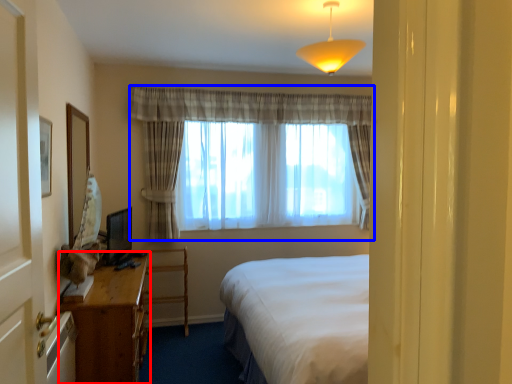
Question: Which of the following is the farthest to the observer, desk (highlighted by a red box) or curtain (highlighted by a blue box)?

Choices:
 (A) desk
 (B) curtain

Answer: (B)